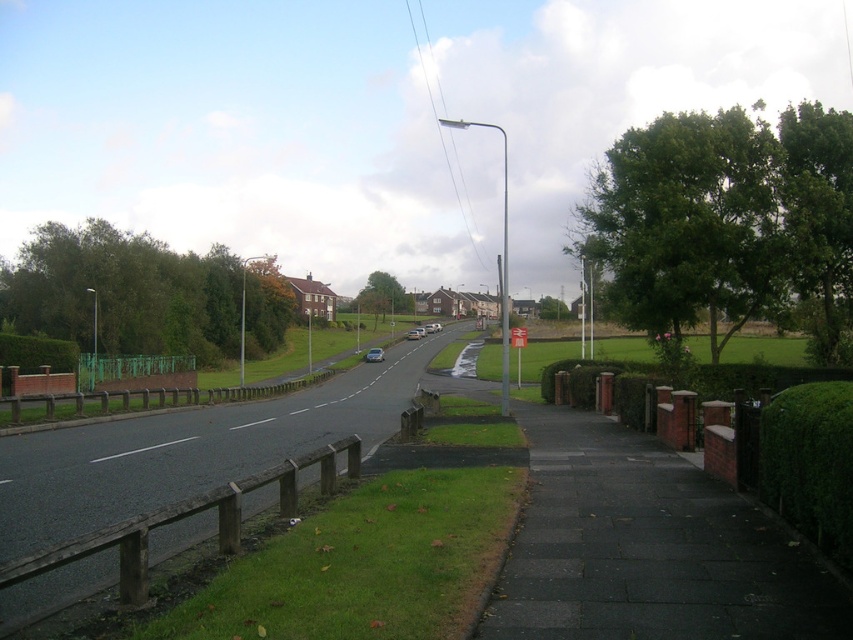
Question: From the image, what is the correct spatial relationship of silver metallic sedan at center in relation to metallic silver car at center?

Choices:
 (A) left
 (B) right

Answer: (A)

Question: Which point appears farthest from the camera in this image?

Choices:
 (A) (421, 326)
 (B) (415, 332)
 (C) (374, 356)

Answer: (A)

Question: Based on their relative distances, which object is farther from the silver metallic sedan at center?

Choices:
 (A) silver metallic car at center
 (B) metallic silver car at center

Answer: (A)

Question: Observing the image, what is the correct spatial positioning of silver metallic car at center in reference to metallic silver car at center?

Choices:
 (A) above
 (B) below

Answer: (B)

Question: Estimate the real-world distances between objects in this image. Which object is closer to the silver metallic sedan at center?

Choices:
 (A) metallic silver car at center
 (B) silver metallic car at center

Answer: (A)

Question: Observing the image, what is the correct spatial positioning of silver metallic sedan at center in reference to metallic silver car at center?

Choices:
 (A) left
 (B) right

Answer: (A)